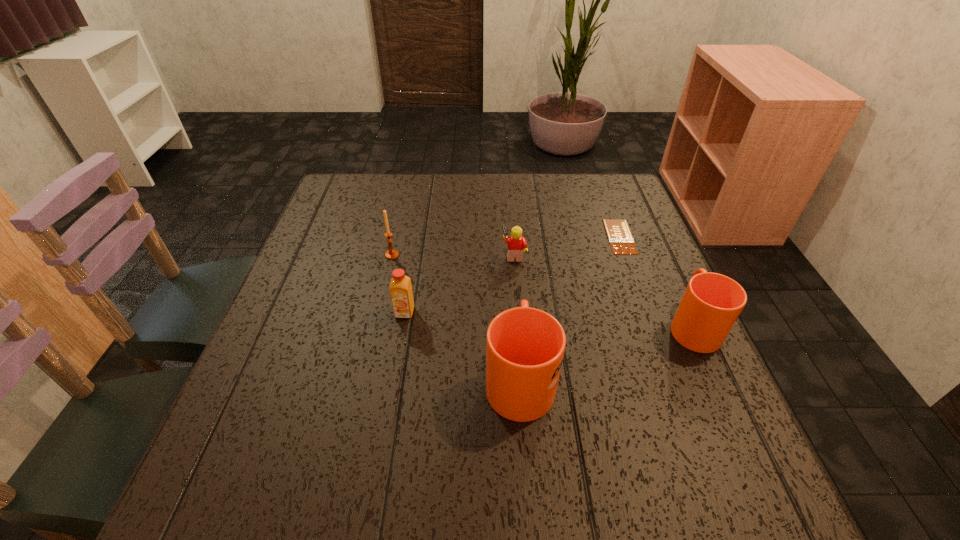
The height and width of the screenshot is (540, 960). Identify the location of the taller mug. (525, 346).

The image size is (960, 540). I want to click on the shorter mug, so pyautogui.click(x=711, y=304).

The height and width of the screenshot is (540, 960). In order to click on the second shortest object in this screenshot , I will do `click(517, 244)`.

Identify the location of candle_holder. This screenshot has height=540, width=960. (391, 254).

The width and height of the screenshot is (960, 540). What are the coordinates of `chocolate bar` in the screenshot? It's located at (621, 241).

Where is `the fifth object from right to left`? Image resolution: width=960 pixels, height=540 pixels. the fifth object from right to left is located at coordinates (400, 287).

Find the location of a particular element. vacant space located on the handle side of the left mug is located at coordinates (508, 226).

Identify the location of vacant region located 0.330m on the handle side of the left mug. This screenshot has height=540, width=960. (509, 240).

Identify the location of vacant space located on the handle side of the left mug. The height and width of the screenshot is (540, 960). (512, 282).

Identify the location of blank space located on the handle side of the right mug. (660, 256).